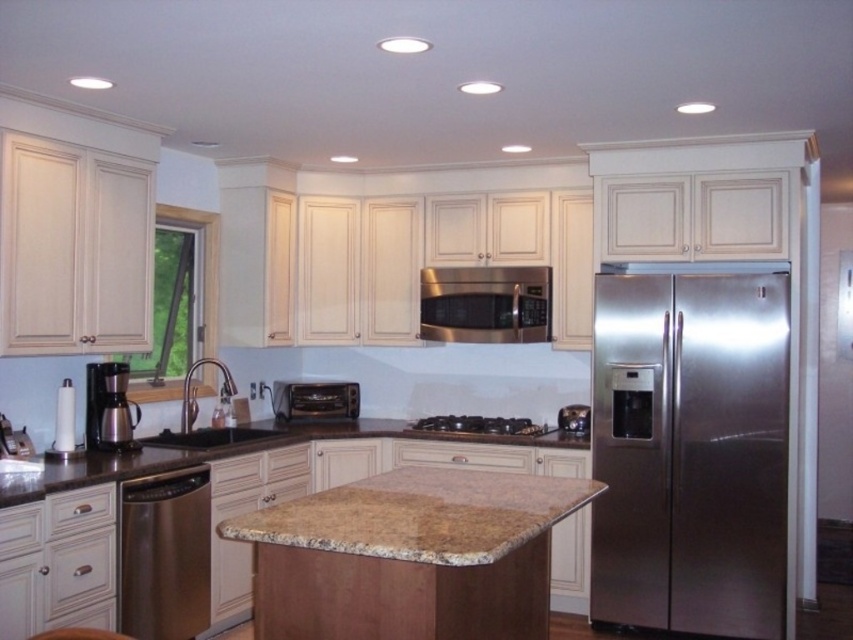
Question: Does metallic coffee maker at lower left have a greater width compared to black granite sink at center?

Choices:
 (A) no
 (B) yes

Answer: (A)

Question: Which of the following is the closest to the observer?

Choices:
 (A) (495, 422)
 (B) (107, 374)

Answer: (B)

Question: From the image, what is the correct spatial relationship of stainless steel refrigerator at right in relation to stainless steel dishwasher at lower left?

Choices:
 (A) above
 (B) below

Answer: (A)

Question: Among these points, which one is farthest from the camera?

Choices:
 (A) (329, 400)
 (B) (431, 320)

Answer: (A)

Question: Does satin stainless steel microwave at upper center come behind metallic coffee maker at lower left?

Choices:
 (A) no
 (B) yes

Answer: (B)

Question: Estimate the real-world distances between objects in this image. Which object is closer to the stainless steel refrigerator at right?

Choices:
 (A) satin stainless steel microwave at upper center
 (B) black granite sink at center
 (C) metallic coffee maker at lower left

Answer: (A)